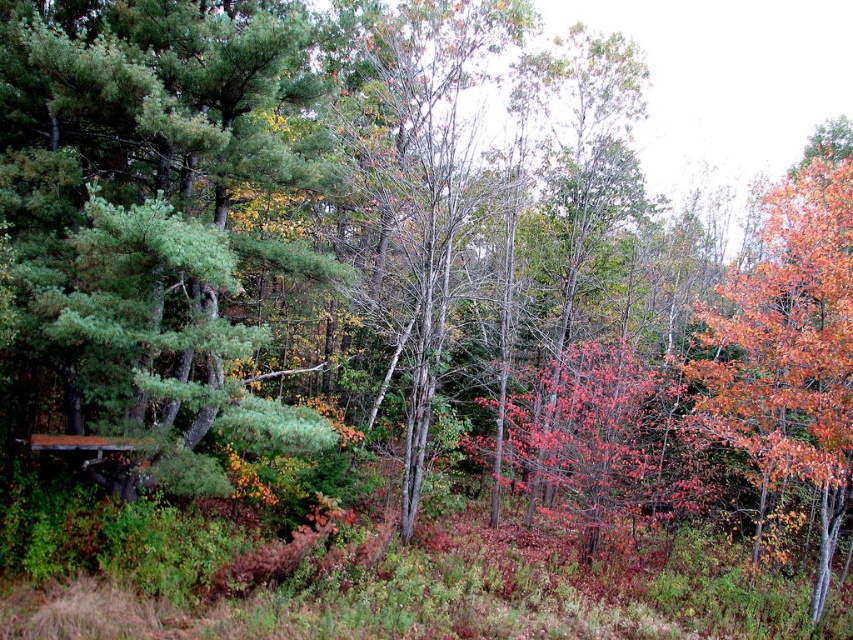
Consider the image. You are planning to set up a tent in the forest scene. The smooth bark tree at center and wooden picnic table at lower left are in your way. Which object should you move to have enough space for the tent?

You should move the wooden picnic table at lower left because the smooth bark tree at center is taller and likely more difficult to move.